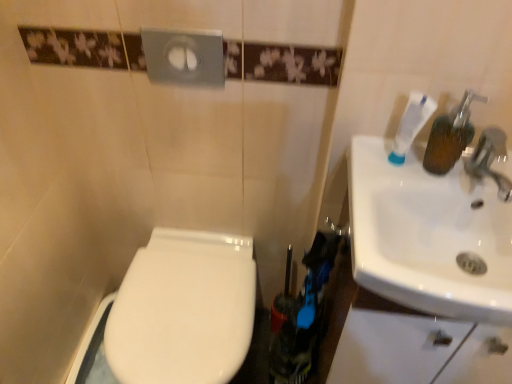
Question: Is white glossy toilet at lower left positioned behind white glossy sink at right?

Choices:
 (A) no
 (B) yes

Answer: (B)

Question: Can you confirm if white glossy toilet at lower left is positioned to the left of white glossy sink at right?

Choices:
 (A) yes
 (B) no

Answer: (A)

Question: From the image's perspective, is white glossy toilet at lower left located beneath white glossy sink at right?

Choices:
 (A) no
 (B) yes

Answer: (B)

Question: Considering the relative sizes of white glossy toilet at lower left and white glossy sink at right in the image provided, is white glossy toilet at lower left wider than white glossy sink at right?

Choices:
 (A) yes
 (B) no

Answer: (A)

Question: Does white glossy toilet at lower left have a smaller size compared to white glossy sink at right?

Choices:
 (A) no
 (B) yes

Answer: (A)

Question: Is white glossy toilet at lower left thinner than white glossy sink at right?

Choices:
 (A) no
 (B) yes

Answer: (A)

Question: From the image's perspective, is white glossy sink at right located above white matte toothpaste at upper right?

Choices:
 (A) no
 (B) yes

Answer: (A)

Question: Are white glossy sink at right and white matte toothpaste at upper right far apart?

Choices:
 (A) no
 (B) yes

Answer: (A)

Question: From the image's perspective, is white glossy sink at right under white matte toothpaste at upper right?

Choices:
 (A) no
 (B) yes

Answer: (B)

Question: Is white glossy sink at right completely or partially outside of white matte toothpaste at upper right?

Choices:
 (A) no
 (B) yes

Answer: (B)

Question: Considering the relative sizes of white glossy sink at right and white matte toothpaste at upper right in the image provided, is white glossy sink at right taller than white matte toothpaste at upper right?

Choices:
 (A) no
 (B) yes

Answer: (A)

Question: Is the position of white glossy sink at right more distant than that of white matte toothpaste at upper right?

Choices:
 (A) no
 (B) yes

Answer: (A)

Question: Is white glossy sink at right further to camera compared to white glossy toilet at lower left?

Choices:
 (A) yes
 (B) no

Answer: (B)